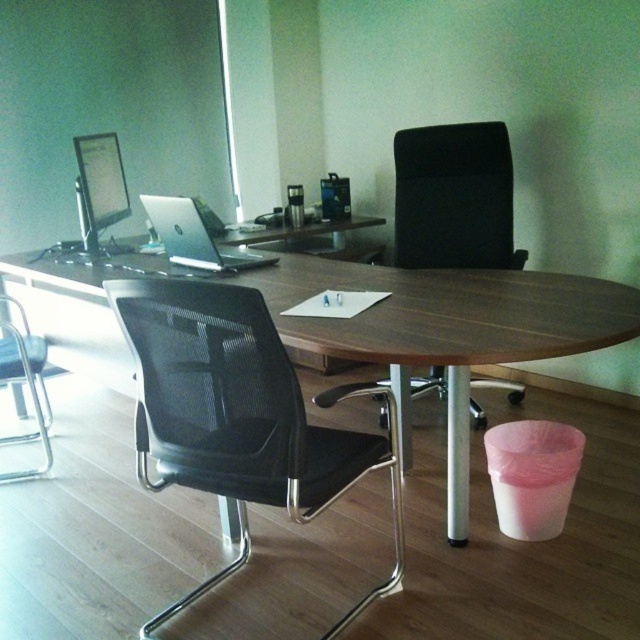
Question: Estimate the real-world distances between objects in this image. Which object is closer to the silver metallic laptop at center?

Choices:
 (A) black mesh chair at center
 (B) black mesh swivel chair at center
 (C) black mesh chair at left

Answer: (C)

Question: Estimate the real-world distances between objects in this image. Which object is closer to the black mesh chair at center?

Choices:
 (A) black mesh swivel chair at center
 (B) wooden desk at center
 (C) black mesh chair at left
 (D) silver metallic laptop at center

Answer: (B)

Question: Where is black mesh swivel chair at center located in relation to black mesh chair at center in the image?

Choices:
 (A) above
 (B) below

Answer: (B)

Question: Which of the following is the closest to the observer?

Choices:
 (A) wooden desk at center
 (B) silver metallic laptop at center

Answer: (A)

Question: Does black mesh chair at center have a lesser width compared to black mesh chair at left?

Choices:
 (A) yes
 (B) no

Answer: (B)

Question: Is black mesh chair at center closer to the viewer compared to black mesh chair at left?

Choices:
 (A) no
 (B) yes

Answer: (A)